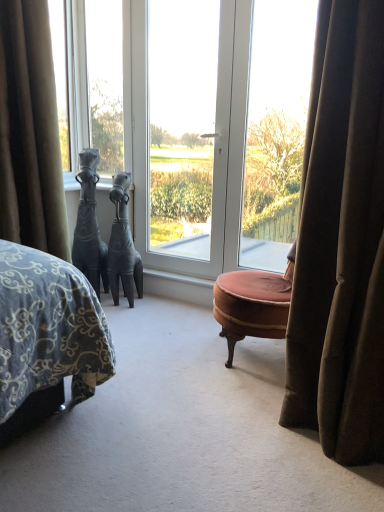
Question: Is transparent glass screen door at center spatially inside matte black sculpture at center, the 2th sculpture viewed from the left, or outside of it?

Choices:
 (A) inside
 (B) outside

Answer: (B)

Question: Is transparent glass screen door at center wider or thinner than matte black sculpture at center, placed as the 1th sculpture when sorted from right to left?

Choices:
 (A) wide
 (B) thin

Answer: (B)

Question: Which object is positioned closest to the brown velvet curtain at left?

Choices:
 (A) black matte horse at left, acting as the second sculpture starting from the right
 (B) transparent glass screen door at center
 (C) clear glass window at center, positioned as the 3th window in left-to-right order
 (D) velvet brown ottoman at center
 (E) clear glass window at center, arranged as the third window when viewed from the right

Answer: (A)

Question: Based on their relative distances, which object is farther from the clear glass window at center, positioned as the 3th window in left-to-right order?

Choices:
 (A) matte black sculpture at center, placed as the 1th sculpture when sorted from right to left
 (B) clear glass window at center, arranged as the third window when viewed from the right
 (C) velvet brown ottoman at center
 (D) white glossy door at center, which ranks as the 2th window in right-to-left order
 (E) brown velvet curtain at left

Answer: (E)